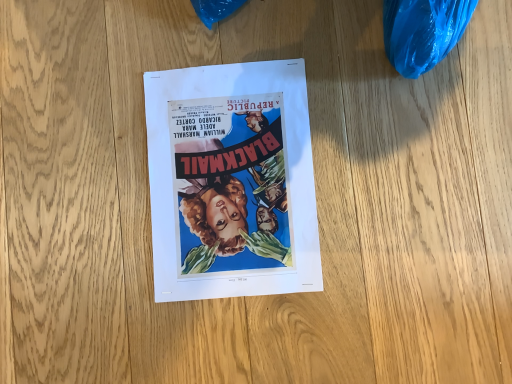
At what (x,y) coordinates should I click in order to perform the action: click on vacant area on top of matte paper poster at center (from a real-world perspective). Please return your answer as a coordinate pair (x, y). The height and width of the screenshot is (384, 512). Looking at the image, I should click on (228, 175).